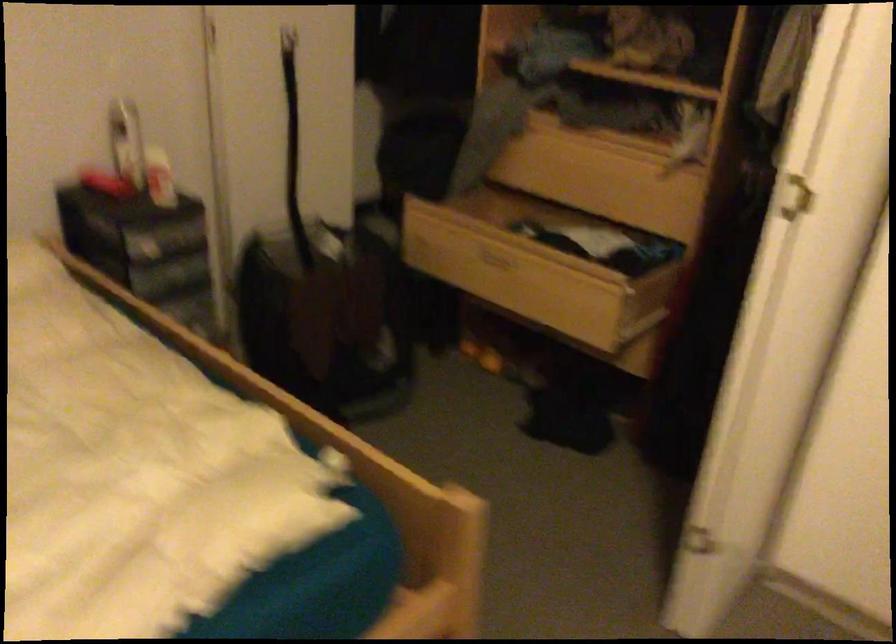
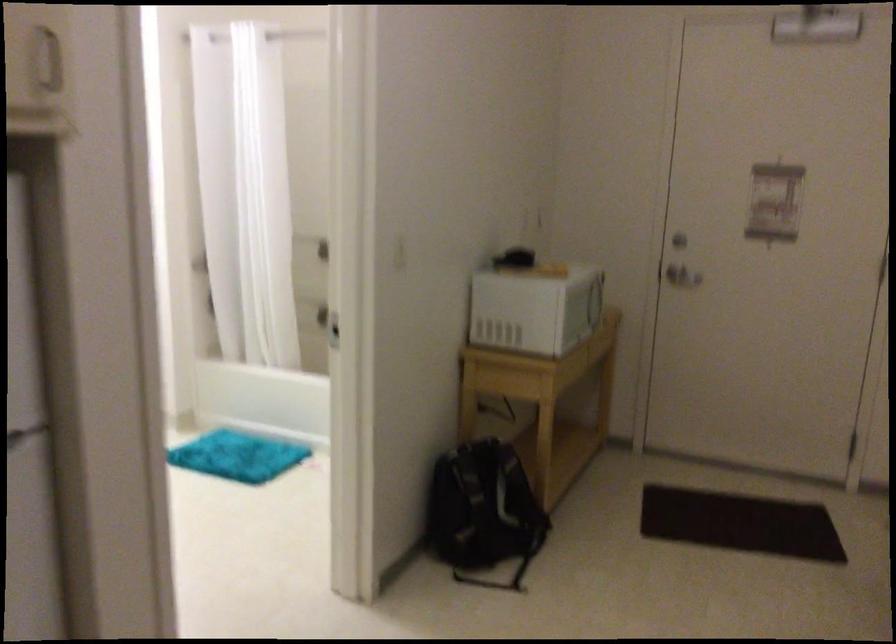
Question: The images are taken continuously from a first-person perspective. In which direction are you moving?

Choices:
 (A) Left
 (B) Right
 (C) Forward
 (D) Backward

Answer: (B)